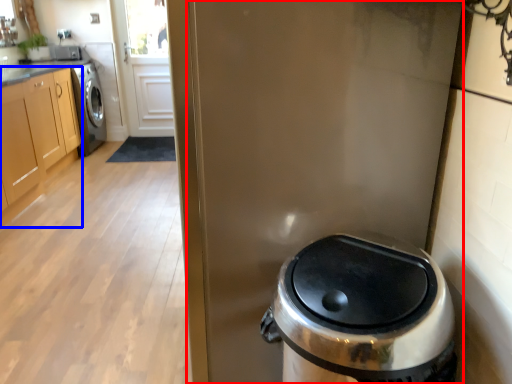
Question: Which object is closer to the camera taking this photo, screen door (highlighted by a red box) or cabinetry (highlighted by a blue box)?

Choices:
 (A) screen door
 (B) cabinetry

Answer: (A)